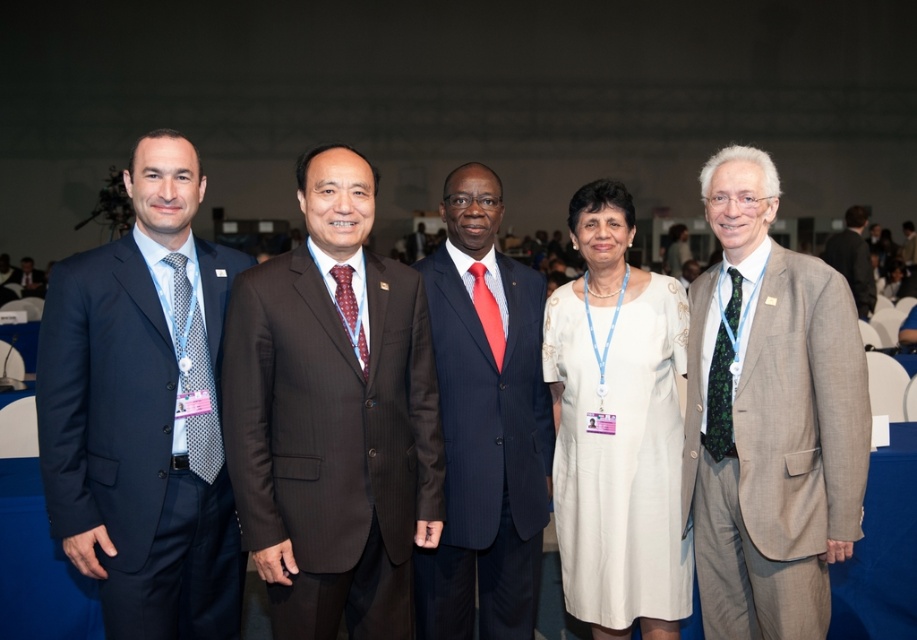
Who is positioned more to the right, dark brown suit at right or matte black suit at left?

Positioned to the right is dark brown suit at right.

Does dark brown suit at right have a lesser height compared to matte black suit at left?

In fact, dark brown suit at right may be taller than matte black suit at left.

Where is `dark brown suit at right`? Image resolution: width=917 pixels, height=640 pixels. dark brown suit at right is located at coordinates (853, 259).

Where is `dark brown suit at right`? The width and height of the screenshot is (917, 640). dark brown suit at right is located at coordinates (853, 259).

The image size is (917, 640). In order to click on navy blue suit at left in this screenshot , I will do point(144,410).

Does navy blue suit at left have a smaller size compared to white satin dress at center?

No.

Locate an element on the screen. navy blue suit at left is located at coordinates (144, 410).

The width and height of the screenshot is (917, 640). In order to click on navy blue suit at left in this screenshot , I will do (x=144, y=410).

Find the location of a particular element. The width and height of the screenshot is (917, 640). light brown wool suit at right is located at coordinates [769, 417].

Image resolution: width=917 pixels, height=640 pixels. Describe the element at coordinates (769, 417) in the screenshot. I see `light brown wool suit at right` at that location.

Is point (763, 285) behind point (854, 291)?

No.

Locate an element on the screen. light brown wool suit at right is located at coordinates (769, 417).